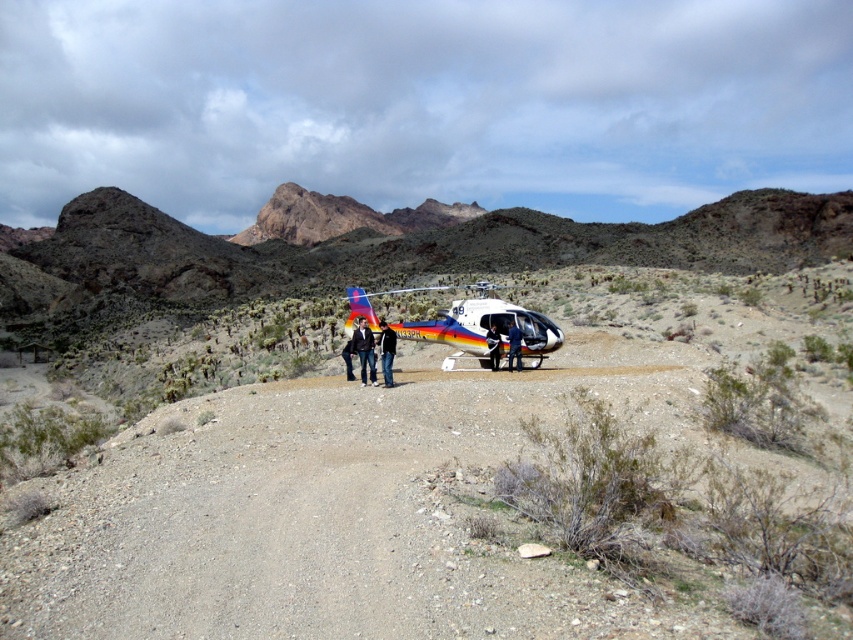
Question: Which of the following is the farthest from the observer?

Choices:
 (A) black leather jacket at center
 (B) blue fabric jacket at center
 (C) white fabric jacket at center
 (D) denim jacket at center

Answer: (C)

Question: Is black leather jacket at center positioned in front of white fabric jacket at center?

Choices:
 (A) no
 (B) yes

Answer: (B)

Question: Is denim jacket at center further to the viewer compared to blue fabric jacket at center?

Choices:
 (A) no
 (B) yes

Answer: (A)

Question: Does black leather jacket at center have a larger size compared to blue fabric jacket at center?

Choices:
 (A) yes
 (B) no

Answer: (A)

Question: Which of these objects is positioned farthest from the denim jacket at center?

Choices:
 (A) black leather jacket at center
 (B) white fabric jacket at center
 (C) dusty gravel dirt track at center
 (D) blue fabric jacket at center

Answer: (C)

Question: Which point appears farthest from the camera in this image?

Choices:
 (A) (461, 316)
 (B) (368, 328)
 (C) (492, 362)

Answer: (C)